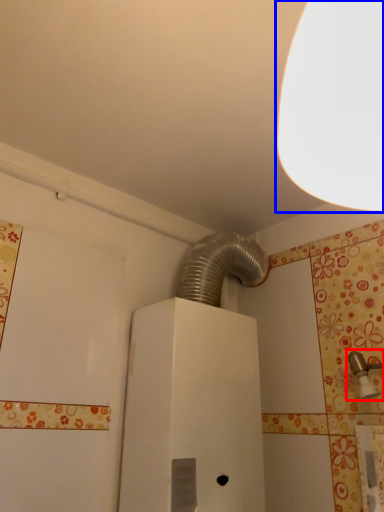
Question: Which object appears farthest to the camera in this image, plumbing fixture (highlighted by a red box) or lamp (highlighted by a blue box)?

Choices:
 (A) plumbing fixture
 (B) lamp

Answer: (A)